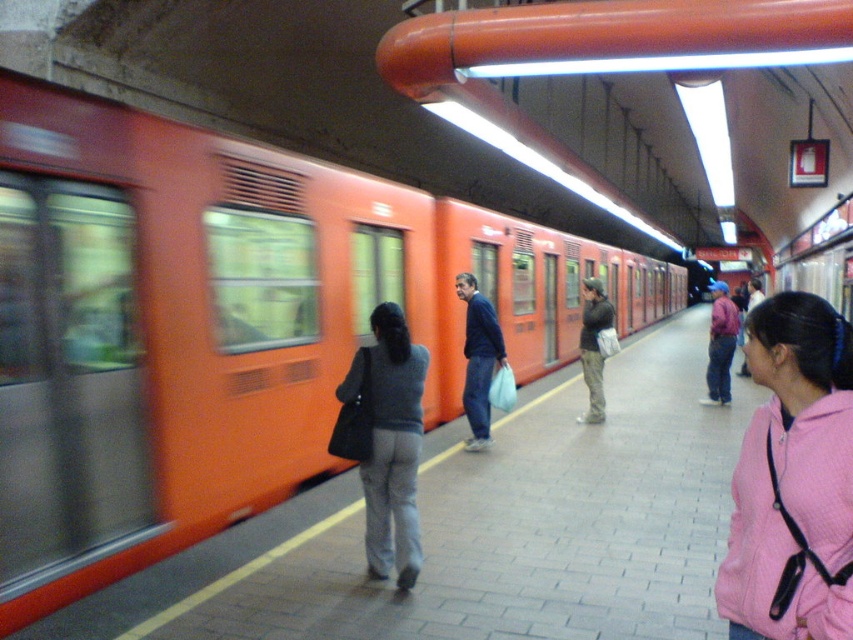
How much distance is there between orange matte train at left and blue fabric jacket at center?

A distance of 1.89 meters exists between orange matte train at left and blue fabric jacket at center.

Is orange matte train at left positioned before blue fabric jacket at center?

Yes, orange matte train at left is closer to the viewer.

Is point (648, 304) positioned behind point (486, 332)?

Yes, it is.

Where is `orange matte train at left`? orange matte train at left is located at coordinates point(221,324).

Between point (598, 404) and point (729, 333), which one is positioned in front?

Positioned in front is point (598, 404).

Which of these two, matte black jacket at center or pink fabric jacket at right, stands taller?

With more height is pink fabric jacket at right.

I want to click on matte black jacket at center, so click(593, 346).

The height and width of the screenshot is (640, 853). What do you see at coordinates (793, 480) in the screenshot? I see `pink fleece jacket at lower right` at bounding box center [793, 480].

You are a GUI agent. You are given a task and a screenshot of the screen. Output one action in this format:
    pyautogui.click(x=<x>, y=<y>)
    Task: Click on the pink fleece jacket at lower right
    This screenshot has height=640, width=853.
    Given the screenshot: What is the action you would take?
    pyautogui.click(x=793, y=480)